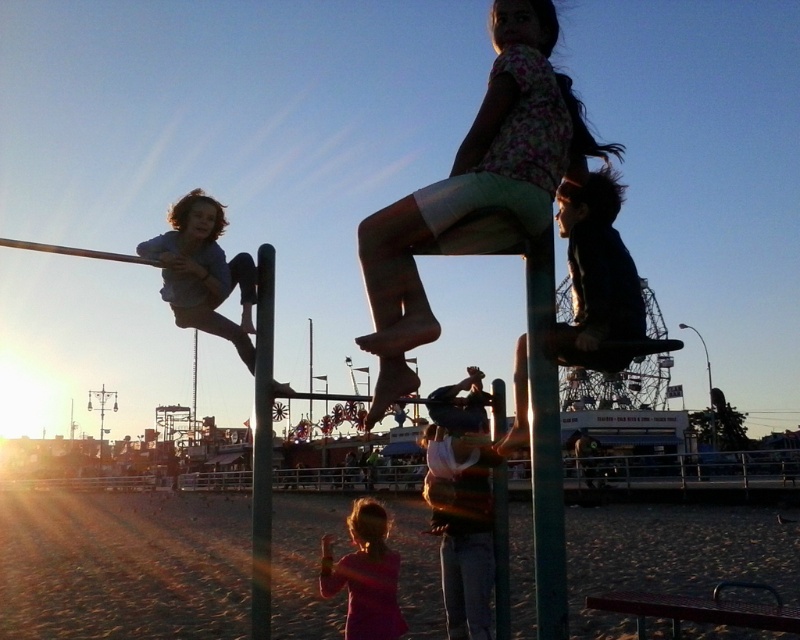
Between light blue denim shorts at left and green textured pole at center, which one is positioned higher?

Positioned higher is light blue denim shorts at left.

Is the position of light blue denim shorts at left less distant than that of green textured pole at center?

Yes.

This screenshot has width=800, height=640. What do you see at coordinates (204, 272) in the screenshot? I see `light blue denim shorts at left` at bounding box center [204, 272].

Image resolution: width=800 pixels, height=640 pixels. Identify the location of light blue denim shorts at left. (204, 272).

Does green metallic pole at center appear on the left side of light blue denim shorts at left?

No, green metallic pole at center is not to the left of light blue denim shorts at left.

Is green metallic pole at center to the right of light blue denim shorts at left from the viewer's perspective?

Correct, you'll find green metallic pole at center to the right of light blue denim shorts at left.

The width and height of the screenshot is (800, 640). I want to click on green metallic pole at center, so click(x=544, y=442).

Between point (538, 336) and point (386, 572), which one is positioned in front?

Point (538, 336) is more forward.

Is point (548, 506) positioned behind point (332, 572)?

No, it is in front of (332, 572).

The width and height of the screenshot is (800, 640). What do you see at coordinates (544, 442) in the screenshot? I see `green metallic pole at center` at bounding box center [544, 442].

Locate an element on the screen. The image size is (800, 640). green metallic pole at center is located at coordinates (544, 442).